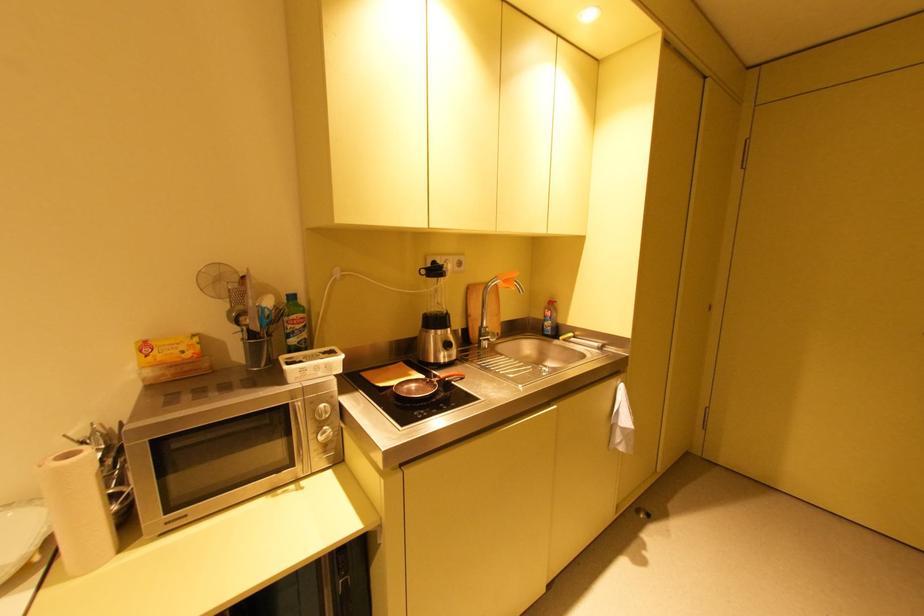
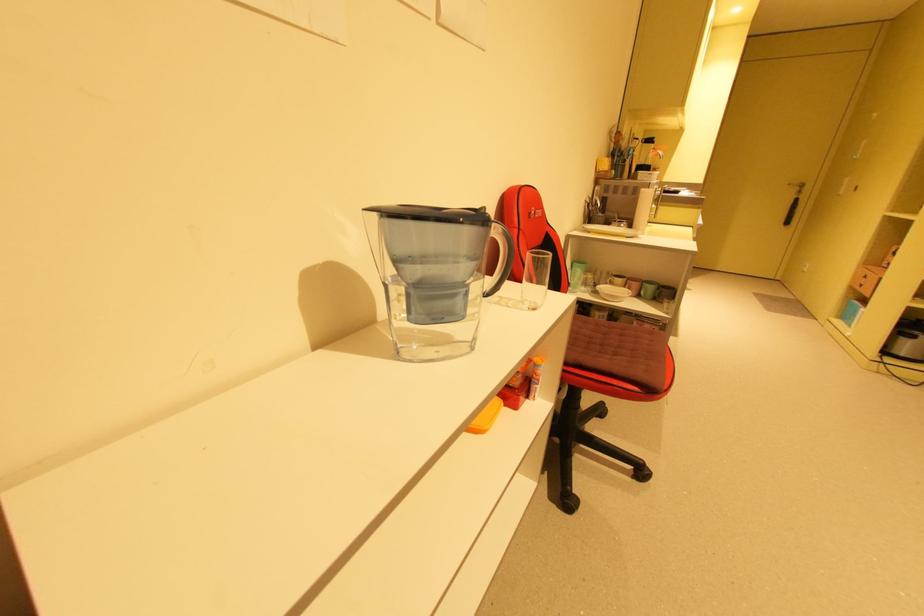
Question: The images are taken continuously from a first-person perspective. In which direction are you moving?

Choices:
 (A) Left
 (B) Right
 (C) Forward
 (D) Backward

Answer: (A)